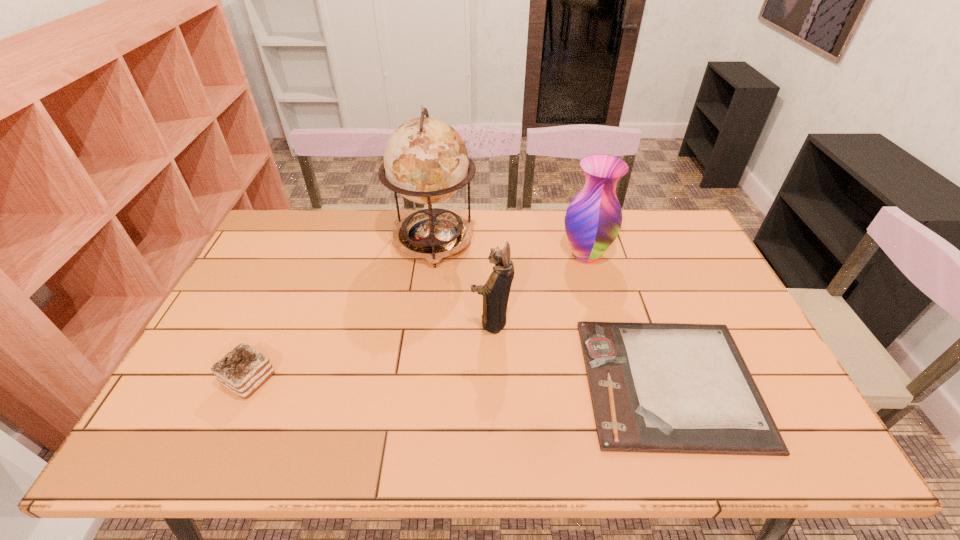
Identify the location of unoccupied position between the chocolate cake and the globe. (341, 310).

The image size is (960, 540). I want to click on vacant area that lies between the chocolate cake and the globe, so click(x=341, y=310).

I want to click on free space that is in between the chocolate cake and the vase, so click(x=418, y=317).

Find the location of a particular element. Image resolution: width=960 pixels, height=540 pixels. free point between the fourth tallest object and the figurine is located at coordinates (371, 350).

Where is `object that ranks as the third closest to the vase`? The width and height of the screenshot is (960, 540). object that ranks as the third closest to the vase is located at coordinates (426, 161).

Point out which object is positioned as the fourth nearest to the fourth tallest object. Please provide its 2D coordinates. Your answer should be formatted as a tuple, i.e. [(x, y)], where the tuple contains the x and y coordinates of a point satisfying the conditions above.

[(593, 219)]

I want to click on free location that satisfies the following two spatial constraints: 1. at the center of the vase; 2. on the right side of the tallest object, so click(x=432, y=255).

Where is `vacant region that satisfies the following two spatial constraints: 1. on the front side of the vase; 2. on the right side of the shortest object`? The width and height of the screenshot is (960, 540). vacant region that satisfies the following two spatial constraints: 1. on the front side of the vase; 2. on the right side of the shortest object is located at coordinates (620, 382).

At what (x,y) coordinates should I click in order to perform the action: click on vacant space that satisfies the following two spatial constraints: 1. on the back side of the shortest object; 2. on the front-facing side of the third shortest object. Please return your answer as a coordinate pair (x, y). Looking at the image, I should click on (648, 322).